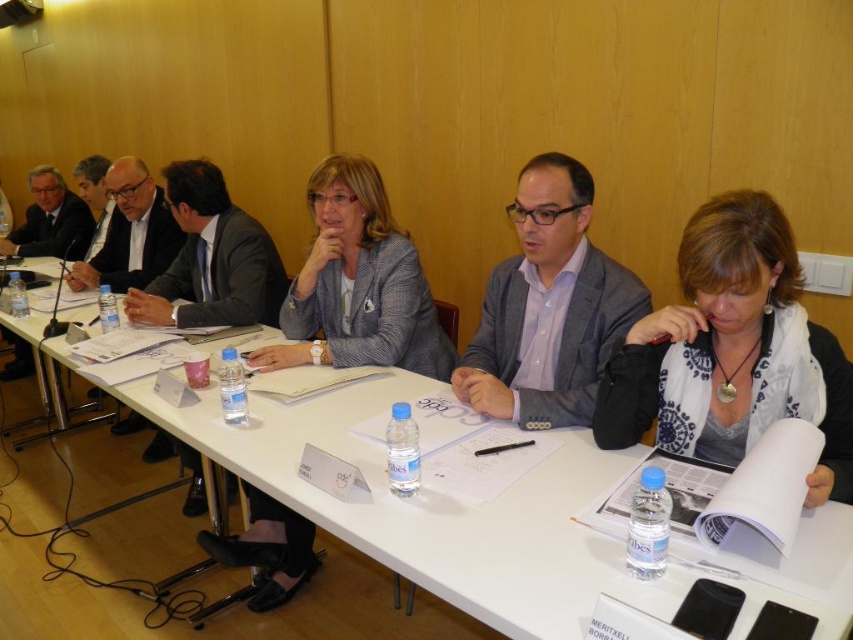
You are a guest attending a formal meeting and need to place your name tag on the table. The name tag is the same size as the gray textured blazer at center. Can you fit it next to the white paper at center without overlapping?

The white paper at center is wider than the gray textured blazer at center. Since your name tag is the same size as the blazer, it should fit next to the paper without overlapping, as there will be enough space.

You are a guest attending a formal meeting and see the white paper at center and the white printed scarf at center on the table. Which item is positioned closer to the left side of the table?

The white paper at center is positioned to the left of the white printed scarf at center, so it is closer to the left side of the table.